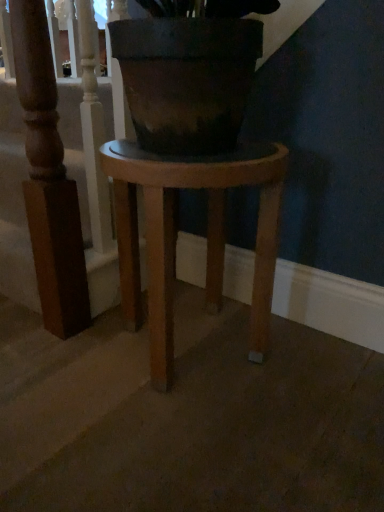
Where is `free space to the left of wooden stool at center`? This screenshot has width=384, height=512. free space to the left of wooden stool at center is located at coordinates (55, 365).